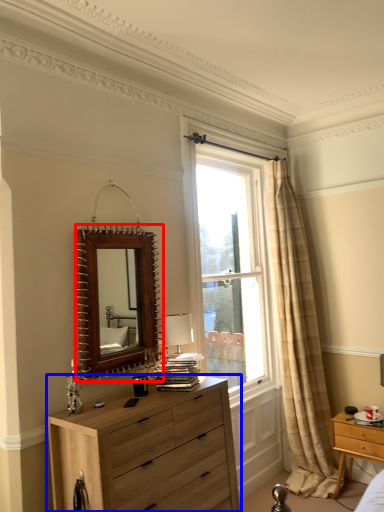
Question: Which of the following is the closest to the observer, mirror (highlighted by a red box) or chest of drawers (highlighted by a blue box)?

Choices:
 (A) mirror
 (B) chest of drawers

Answer: (B)